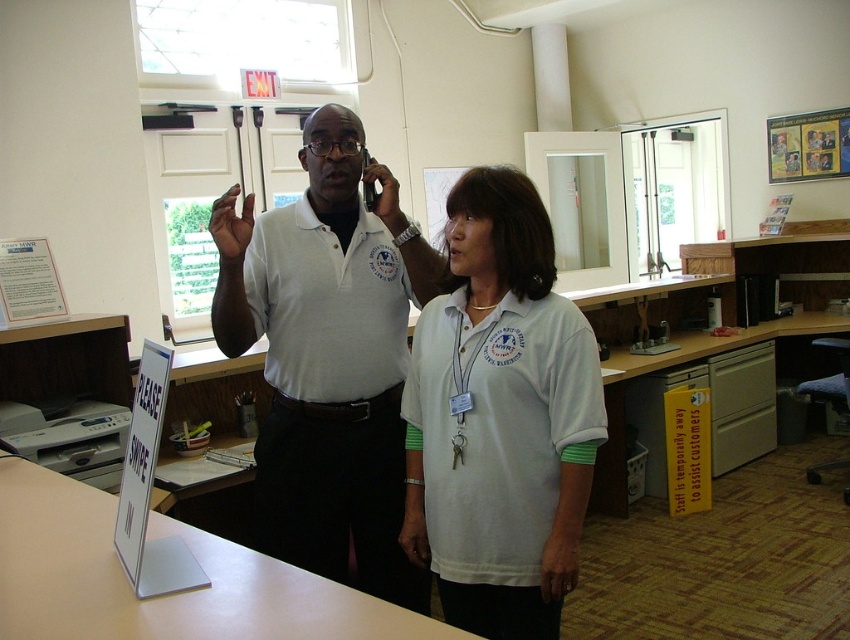
Does white cotton shirt at center appear on the right side of white matte shirt at center?

Indeed, white cotton shirt at center is positioned on the right side of white matte shirt at center.

Who is more forward, [575,385] or [401,586]?

Positioned in front is point [575,385].

At what (x,y) coordinates should I click in order to perform the action: click on white cotton shirt at center. Please return your answer as a coordinate pair (x, y). The height and width of the screenshot is (640, 850). Looking at the image, I should click on (500, 417).